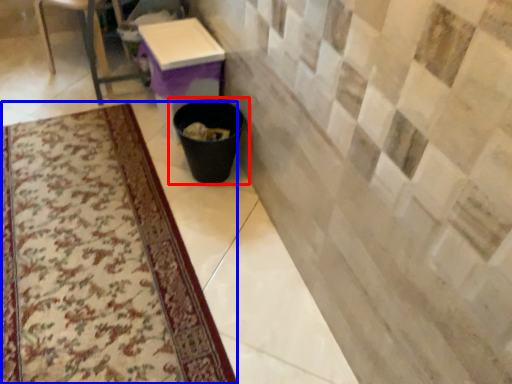
Question: Which point is closer to the camera, waste container (highlighted by a red box) or mat (highlighted by a blue box)?

Choices:
 (A) waste container
 (B) mat

Answer: (B)